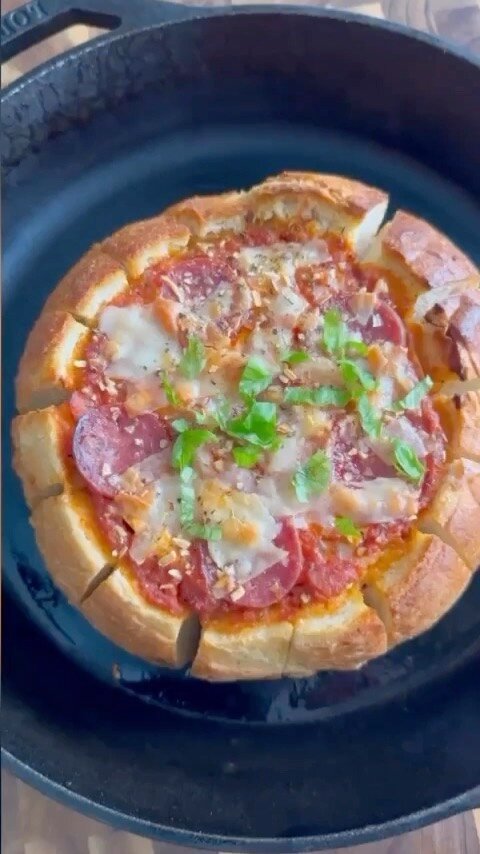
This screenshot has width=480, height=854. In order to click on wood table in this screenshot , I will do `click(52, 821)`.